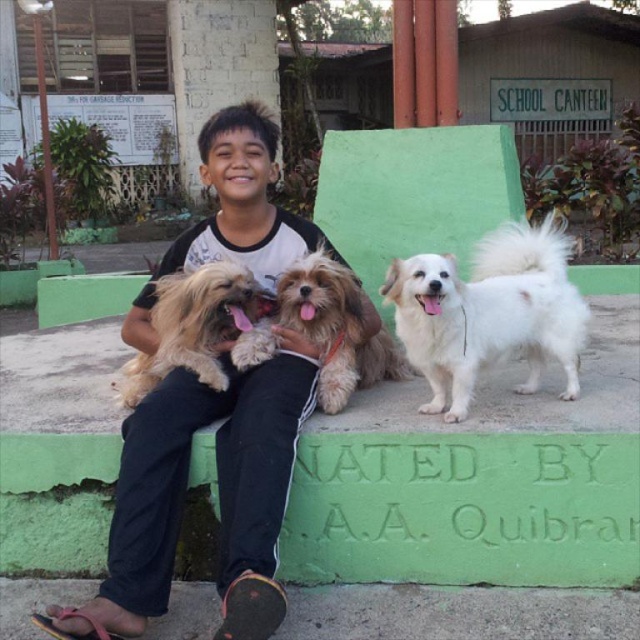
Question: Which is nearer to the white fluffy dog at right?

Choices:
 (A) light brown fur at center
 (B) black cotton shirt at center

Answer: (A)

Question: Does white fluffy dog at right appear over light brown fur at center?

Choices:
 (A) no
 (B) yes

Answer: (B)

Question: Can you confirm if black cotton shirt at center is wider than light brown fur at center?

Choices:
 (A) yes
 (B) no

Answer: (A)

Question: Is black cotton shirt at center in front of fuzzy brown dog at center?

Choices:
 (A) yes
 (B) no

Answer: (A)

Question: Which point is farther to the camera?

Choices:
 (A) black cotton shirt at center
 (B) white fluffy dog at right
 (C) light brown fur at center

Answer: (C)

Question: Which object is closer to the camera taking this photo?

Choices:
 (A) light brown fur at center
 (B) white fluffy dog at right
 (C) black cotton shirt at center
 (D) fuzzy brown dog at center

Answer: (C)